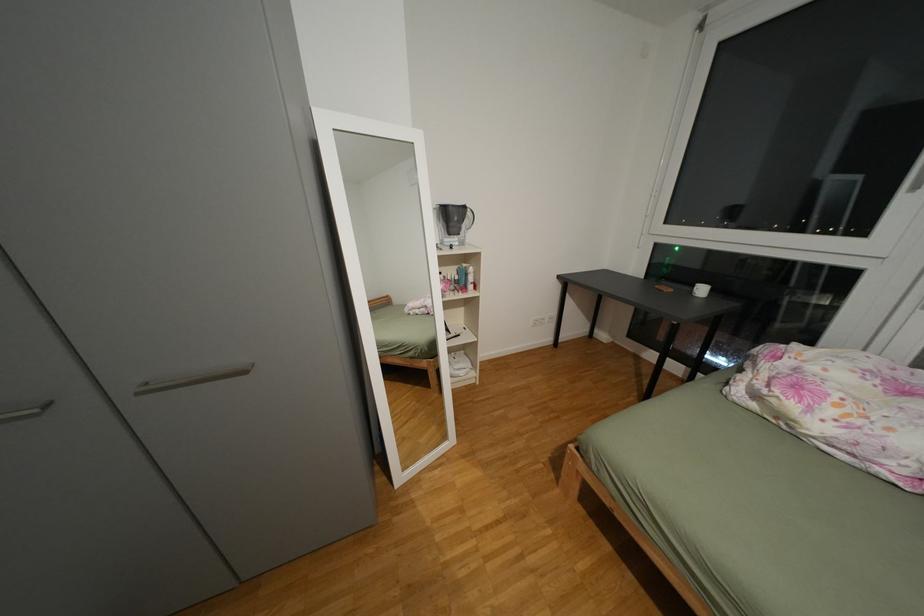
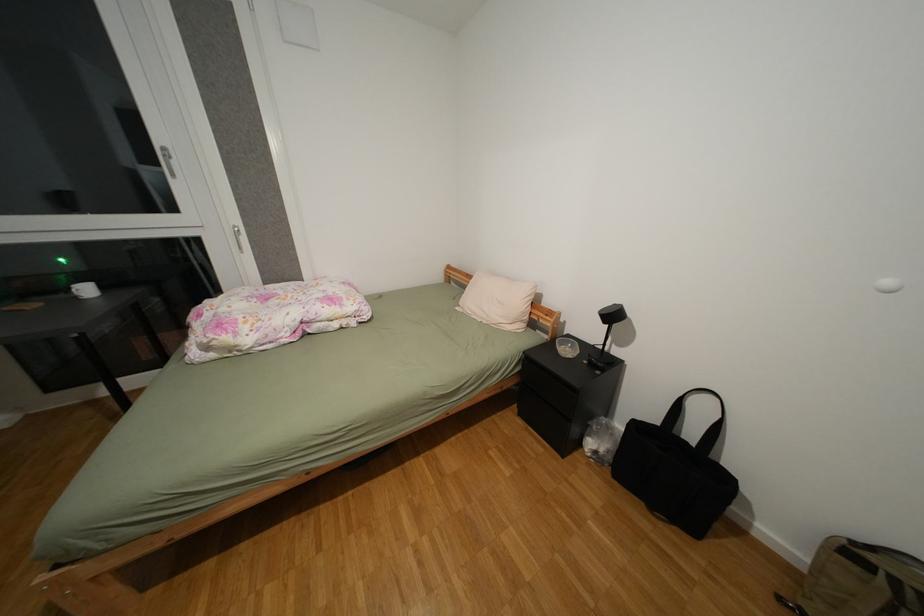
The images are taken continuously from a first-person perspective. In which direction is your viewpoint rotating?

The rotation direction of the camera is right-down.